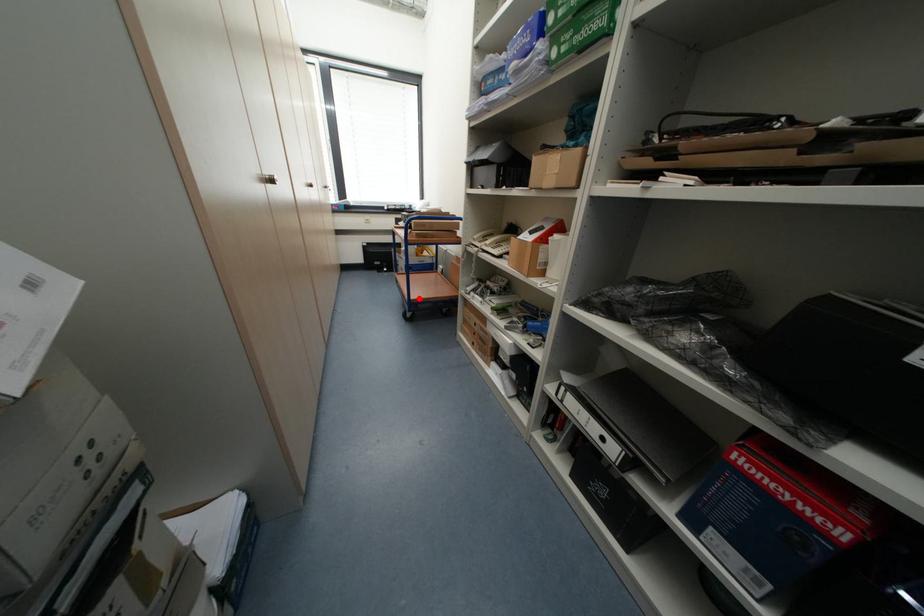
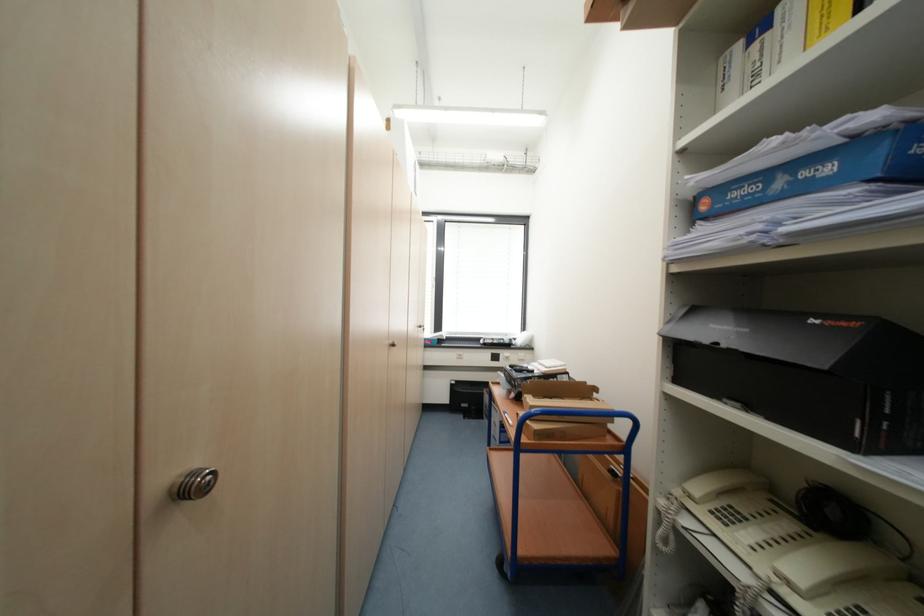
Question: I am providing you with two images of the same scene from different viewpoints. Given a red point in image1, look at the same physical point in image2. Is it:

Choices:
 (A) Closer to the viewpoint
 (B) Farther from the viewpoint

Answer: (B)